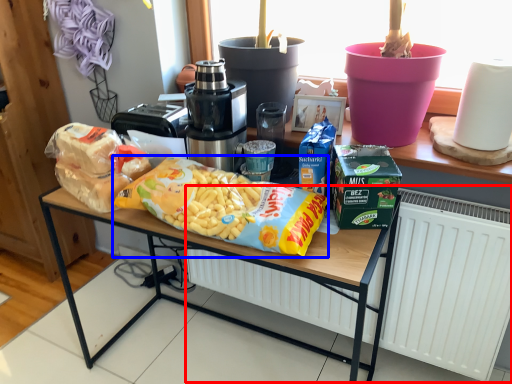
Question: Which object appears farthest to the camera in this image, radiator (highlighted by a red box) or cereal (highlighted by a blue box)?

Choices:
 (A) radiator
 (B) cereal

Answer: (A)